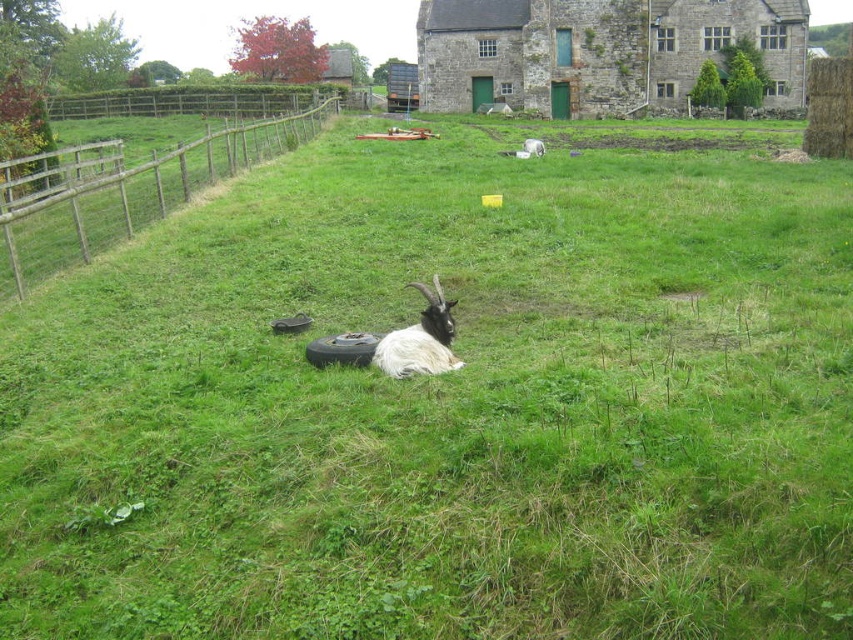
Question: Among these points, which one is farthest from the camera?

Choices:
 (A) (163, 163)
 (B) (541, 144)

Answer: (B)

Question: In this image, where is brown wooden fence at left located relative to white fluffy goat at center?

Choices:
 (A) above
 (B) below

Answer: (A)

Question: Which of the following is the closest to the observer?

Choices:
 (A) (132, 218)
 (B) (424, 337)
 (C) (538, 152)

Answer: (B)

Question: Can you confirm if brown wooden fence at left is positioned above white fluffy goat at center?

Choices:
 (A) yes
 (B) no

Answer: (A)

Question: Can you confirm if brown wooden fence at left is positioned above white fluffy goat at center?

Choices:
 (A) no
 (B) yes

Answer: (B)

Question: Estimate the real-world distances between objects in this image. Which object is farther from the brown wooden fence at left?

Choices:
 (A) white woolen sheep at center
 (B) white fluffy goat at center

Answer: (B)